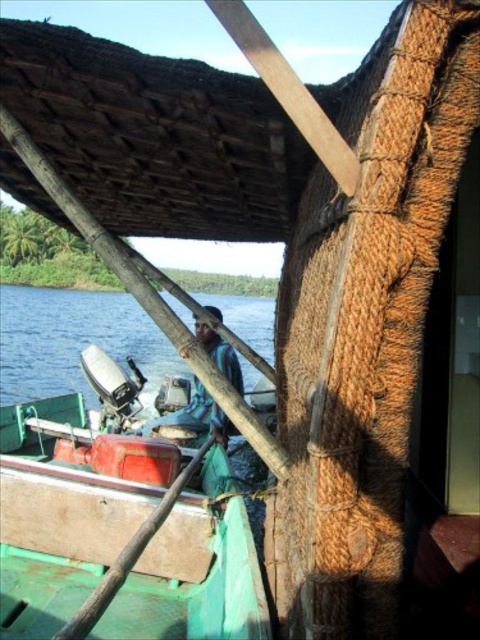
You are on a boat and need to determine which object takes up more space in your view. Which is larger between the blue water at lower left and the blue fabric shirt at center?

The blue water at lower left is bigger than the blue fabric shirt at center, so the blue water at lower left takes up more space in the view.

You are standing on the deck of the green matte boat at center and want to look at the blue water at lower left. Which direction should you move to get a better view of it?

Since the green matte boat at center is in front of the blue water at lower left, you should move towards the back of the boat to see the blue water at lower left more clearly.